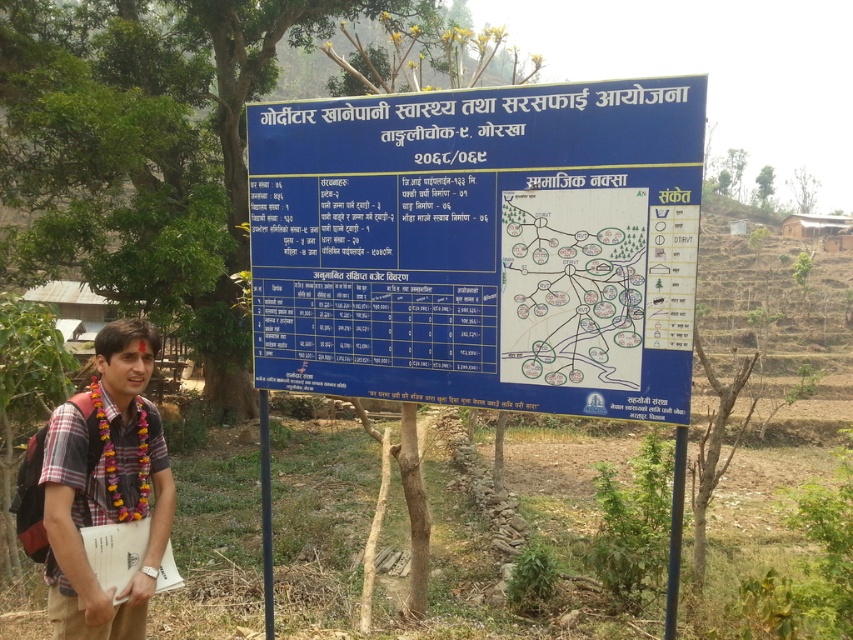
Which of these two, blue plastic signboard at center or white paper map at center, stands shorter?

With less height is white paper map at center.

Does blue plastic signboard at center have a smaller size compared to white paper map at center?

Incorrect, blue plastic signboard at center is not smaller in size than white paper map at center.

Which is behind, point (550, 102) or point (564, 218)?

Point (564, 218)

I want to click on blue plastic signboard at center, so click(480, 244).

Between blue plastic signboard at center and plaid shirt at center, which one has more height?

Standing taller between the two is blue plastic signboard at center.

Does blue plastic signboard at center have a smaller size compared to plaid shirt at center?

No, blue plastic signboard at center is not smaller than plaid shirt at center.

Describe the element at coordinates (480, 244) in the screenshot. I see `blue plastic signboard at center` at that location.

You are a GUI agent. You are given a task and a screenshot of the screen. Output one action in this format:
    pyautogui.click(x=<x>, y=<y>)
    Task: Click on the blue plastic signboard at center
    
    Given the screenshot: What is the action you would take?
    pyautogui.click(x=480, y=244)

Is white paper map at center to the right of plaid shirt at center from the viewer's perspective?

Yes, white paper map at center is to the right of plaid shirt at center.

Who is lower down, white paper map at center or plaid shirt at center?

plaid shirt at center is below.

Between point (538, 381) and point (157, 529), which one is positioned in front?

Point (157, 529)

At what (x,y) coordinates should I click in order to perform the action: click on white paper map at center. Please return your answer as a coordinate pair (x, y). This screenshot has height=640, width=853. Looking at the image, I should click on (572, 282).